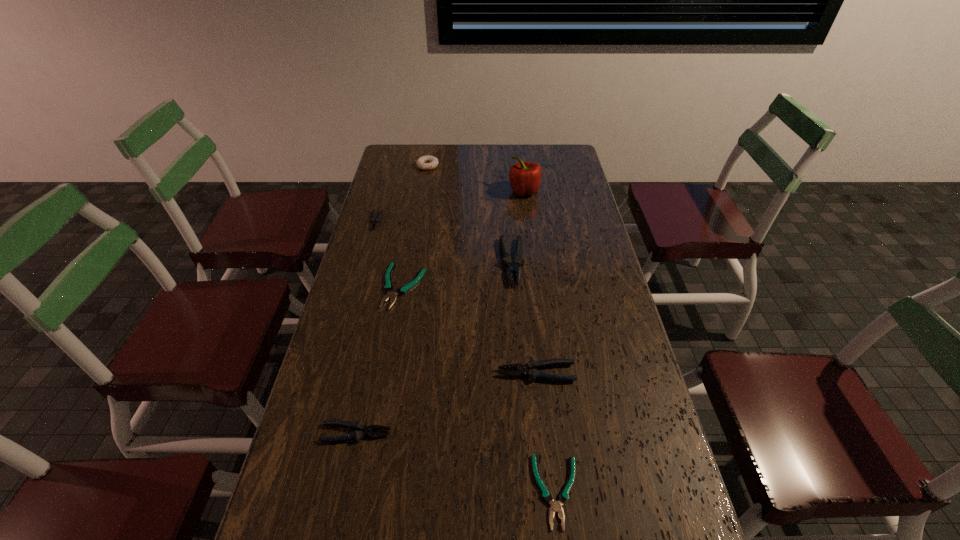
Where is `pliers that is the second closest to the second nearest pliers`? This screenshot has width=960, height=540. pliers that is the second closest to the second nearest pliers is located at coordinates (556, 506).

Locate an element on the screen. pliers object that ranks as the closest to the pink bell pepper is located at coordinates (512, 268).

Locate which gray pliers is the third closest to the smallest gray pliers. Please provide its 2D coordinates. Your answer should be formatted as a tuple, i.e. [(x, y)], where the tuple contains the x and y coordinates of a point satisfying the conditions above.

[(357, 435)]

Identify which gray pliers is the nearest to the fifth tallest pliers. Please provide its 2D coordinates. Your answer should be formatted as a tuple, i.e. [(x, y)], where the tuple contains the x and y coordinates of a point satisfying the conditions above.

[(374, 222)]

Identify which teal pliers is located as the second nearest to the tallest pliers. Please provide its 2D coordinates. Your answer should be formatted as a tuple, i.e. [(x, y)], where the tuple contains the x and y coordinates of a point satisfying the conditions above.

[(556, 506)]

Locate which teal pliers ranks in proximity to the white doughnut. Please provide its 2D coordinates. Your answer should be formatted as a tuple, i.e. [(x, y)], where the tuple contains the x and y coordinates of a point satisfying the conditions above.

[(388, 287)]

This screenshot has height=540, width=960. In order to click on vacant space that satisfies the following two spatial constraints: 1. on the back side of the doughnut; 2. on the left side of the left teal pliers in this screenshot , I will do `click(425, 166)`.

Locate an element on the screen. Image resolution: width=960 pixels, height=540 pixels. free space that satisfies the following two spatial constraints: 1. on the front side of the left teal pliers; 2. on the right side of the nearest object is located at coordinates (369, 491).

Where is `free region that satisfies the following two spatial constraints: 1. on the front side of the left teal pliers; 2. on the left side of the nearer teal pliers`? free region that satisfies the following two spatial constraints: 1. on the front side of the left teal pliers; 2. on the left side of the nearer teal pliers is located at coordinates (369, 491).

The width and height of the screenshot is (960, 540). What are the coordinates of `vacant point that satisfies the following two spatial constraints: 1. on the back side of the pink bell pepper; 2. on the left side of the second shortest pliers` in the screenshot? It's located at (420, 191).